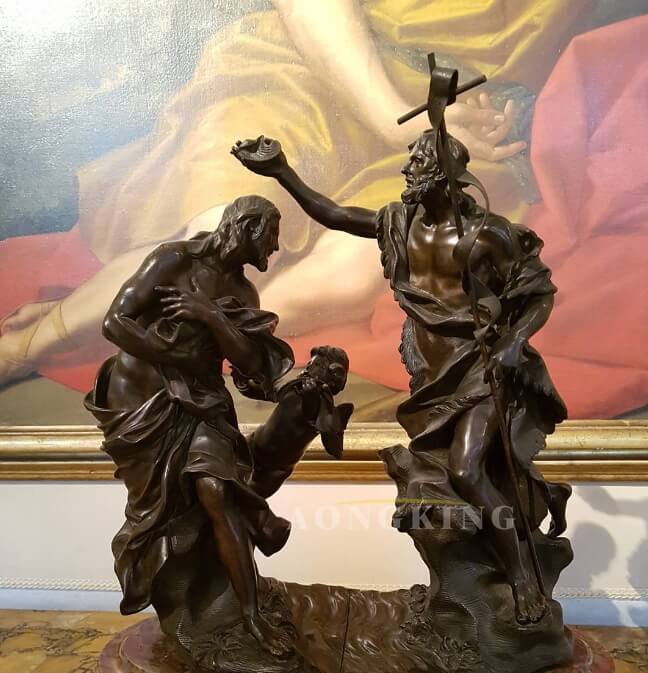
I want to click on wall, so click(623, 534).